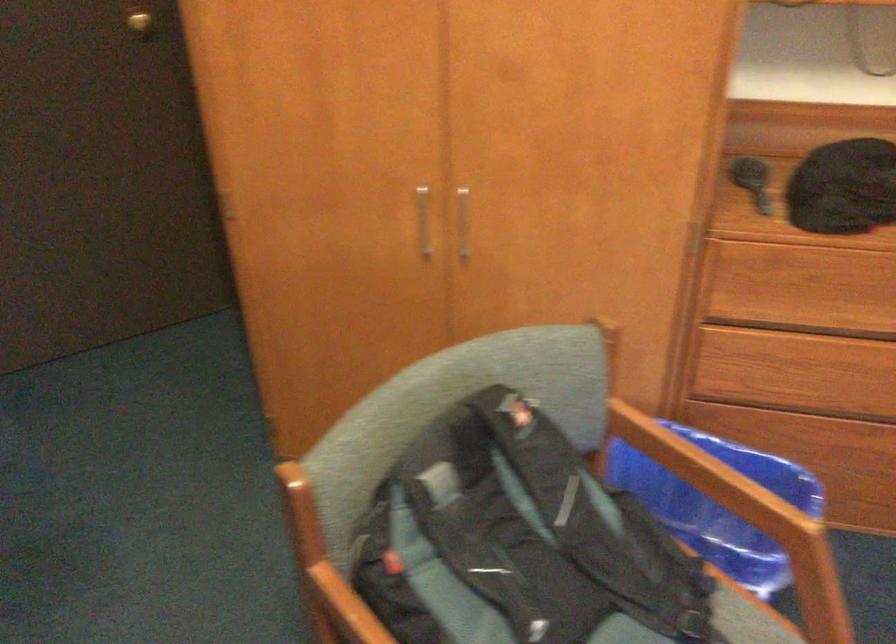
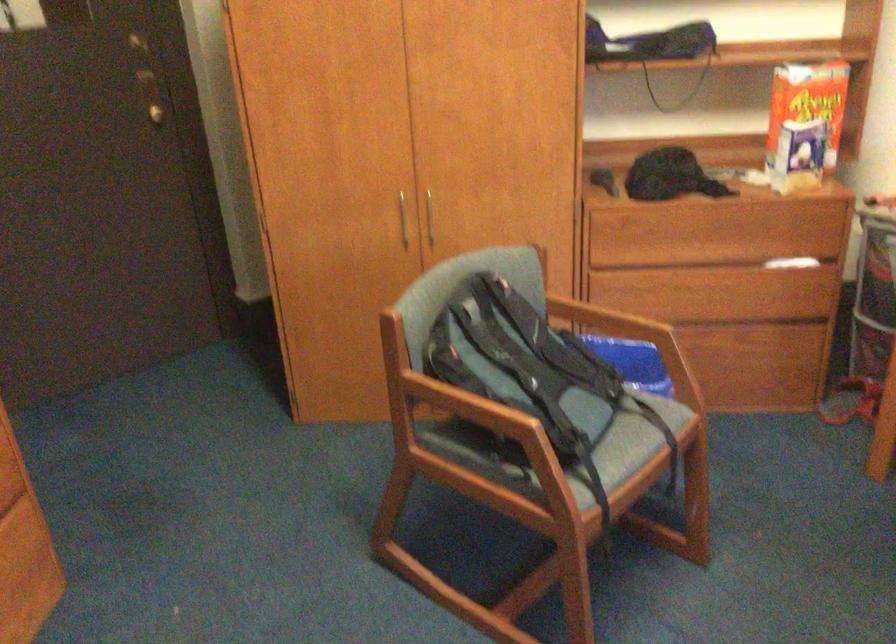
In the second image, find the point that corresponds to point 540,556 in the first image.

(522, 364)